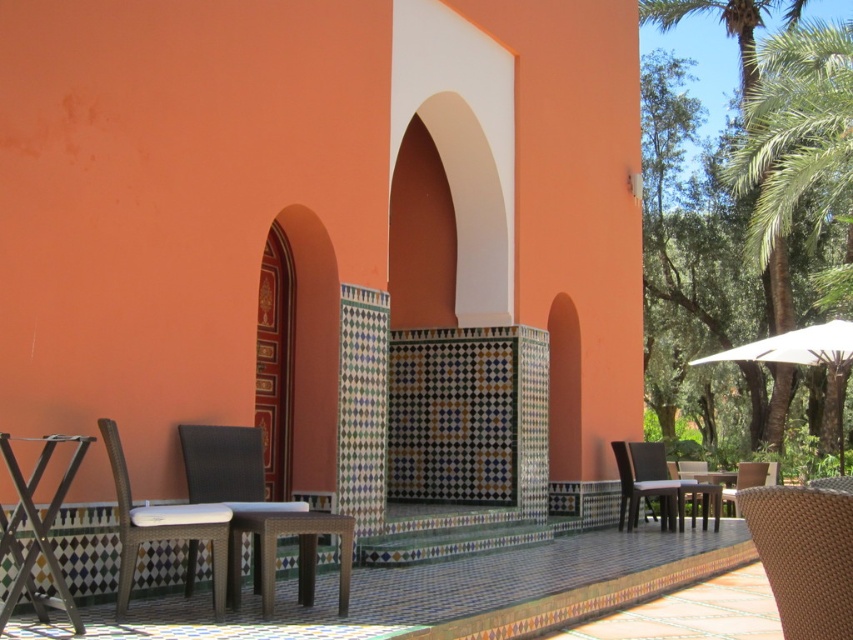
Is green leafy palm tree at right smaller than white fabric umbrella at right?

Actually, green leafy palm tree at right might be larger than white fabric umbrella at right.

Does green leafy palm tree at right come in front of white fabric umbrella at right?

No.

Identify the location of green leafy palm tree at right. The image size is (853, 640). (724, 22).

The image size is (853, 640). What are the coordinates of `green leafy palm tree at right` in the screenshot? It's located at (724, 22).

Between point (39, 467) and point (699, 364), which one is positioned behind?

The point (699, 364) is behind.

Can you confirm if metallic silver table at lower left is shorter than white fabric umbrella at right?

Incorrect, metallic silver table at lower left's height does not fall short of white fabric umbrella at right's.

Is point (55, 582) farther from viewer compared to point (840, 460)?

No, it is not.

This screenshot has height=640, width=853. Identify the location of metallic silver table at lower left. (38, 529).

In the scene shown: Does green leafy palm tree at right appear under rattan chair at lower right?

Actually, green leafy palm tree at right is above rattan chair at lower right.

Which is in front, point (750, 56) or point (660, 476)?

Point (660, 476) is in front.

This screenshot has height=640, width=853. Identify the location of green leafy palm tree at right. (724, 22).